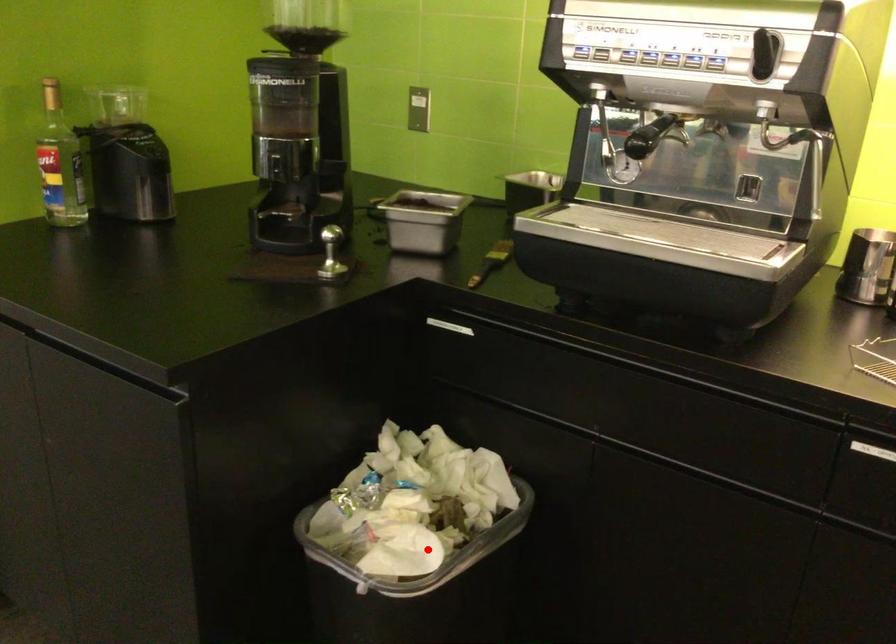
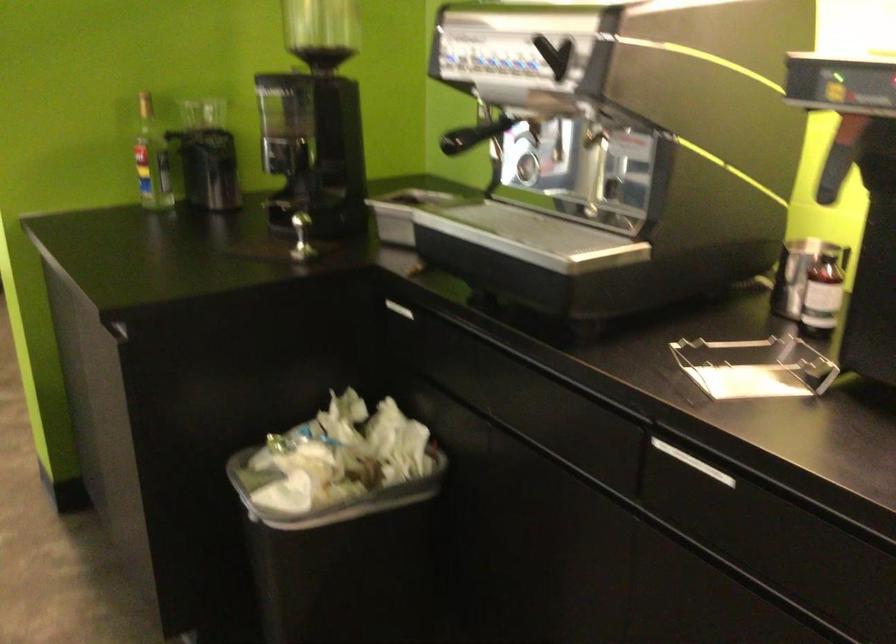
In the second image, find the point that corresponds to the highlighted location in the first image.

(328, 495)